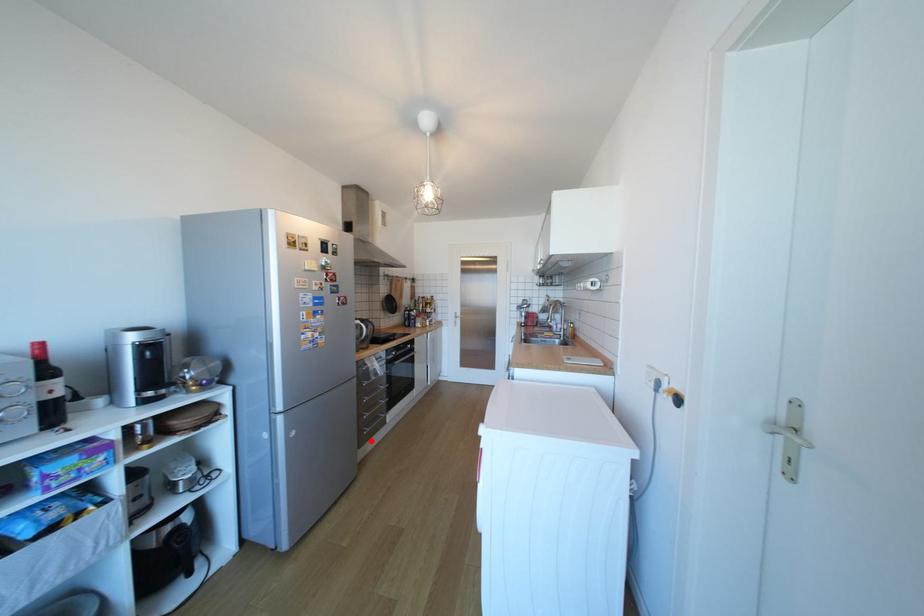
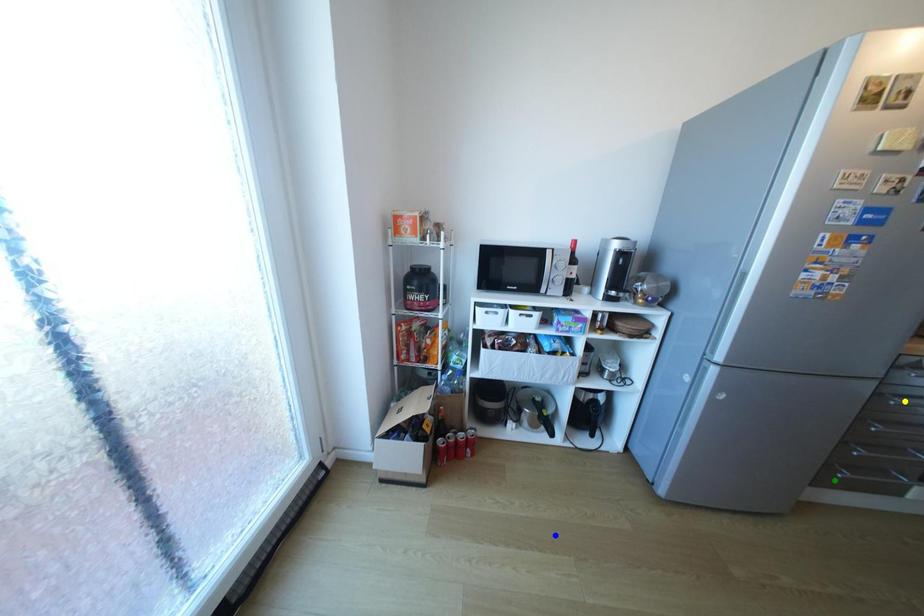
Question: I am providing you with two images of the same scene from different viewpoints. A red point is marked on the first image. You are given multiple points on the second image. Can you choose the point in image 2 that corresponds to the point in image 1?

Choices:
 (A) yellow point
 (B) green point
 (C) blue point

Answer: (B)